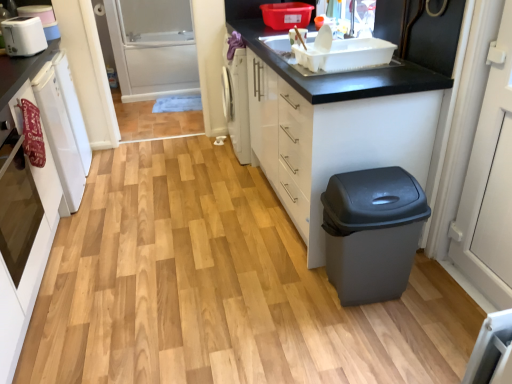
Question: From the image's perspective, is white glossy cabinet at lower right, the 2th cabinetry when ordered from left to right, positioned above or below matte gray plastic trash can at lower right?

Choices:
 (A) above
 (B) below

Answer: (A)

Question: In the image, is white glossy cabinet at lower right, the 2th cabinetry when ordered from left to right, positioned in front of or behind matte gray plastic trash can at lower right?

Choices:
 (A) behind
 (B) front

Answer: (A)

Question: Based on their relative distances, which object is farther from the matte gray plastic trash can at lower right?

Choices:
 (A) white plastic toaster at upper left
 (B) white glossy oven at left, which is counted as the 2th cabinetry, starting from the right
 (C) white glossy cabinet at lower right, the 2th cabinetry when ordered from left to right
 (D) white matte dishwasher at left
 (E) white plastic sink at upper center

Answer: (A)

Question: Which of these objects is positioned closest to the white glossy cabinet at lower right, the 2th cabinetry when ordered from left to right?

Choices:
 (A) white plastic toaster at upper left
 (B) white plastic sink at upper center
 (C) white matte dishwasher at left
 (D) white glossy oven at left
 (E) white glossy oven at left, acting as the first cabinetry starting from the left

Answer: (B)